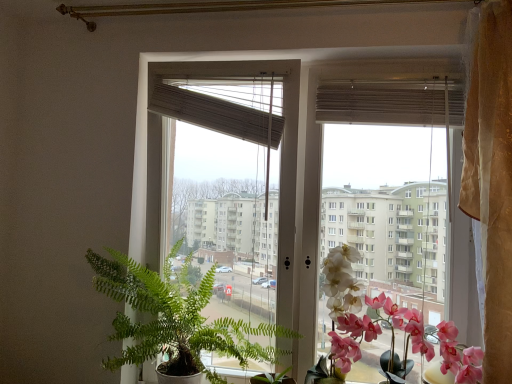
Consider the image. Measure the distance between point (492, 121) and camera.

The depth of point (492, 121) is 4.44 feet.

The height and width of the screenshot is (384, 512). What do you see at coordinates (381, 103) in the screenshot?
I see `matte brown blind at upper center, placed as the second blind when sorted from left to right` at bounding box center [381, 103].

At what (x,y) coordinates should I click in order to perform the action: click on matte brown blind at upper center, which appears as the first blind when viewed from the right. Please return your answer as a coordinate pair (x, y). This screenshot has width=512, height=384. Looking at the image, I should click on (381, 103).

The image size is (512, 384). Describe the element at coordinates (146, 137) in the screenshot. I see `transparent glass window at center` at that location.

The image size is (512, 384). What are the coordinates of `green leafy plant at left` in the screenshot? It's located at (175, 319).

Image resolution: width=512 pixels, height=384 pixels. Describe the element at coordinates (344, 307) in the screenshot. I see `white matte orchid at right, which is the 1th flower in left-to-right order` at that location.

Identify the location of beige textured curtain at right. (490, 174).

Which point is more distant from viewer, (360, 304) or (144, 209)?

The point (144, 209) is farther from the camera.

Is pink silk orchid at right, the 1th flower viewed from the right, not close to transparent glass window at center?

No.

Could you measure the distance between pink silk orchid at right, positioned as the 2th flower in left-to-right order, and transparent glass window at center?

pink silk orchid at right, positioned as the 2th flower in left-to-right order, and transparent glass window at center are 16.32 inches apart from each other.

Is pink silk orchid at right, the 1th flower viewed from the right, wider or thinner than transparent glass window at center?

In the image, pink silk orchid at right, the 1th flower viewed from the right, appears to be wider than transparent glass window at center.

Does white matte orchid at right, which is the 1th flower in left-to-right order, appear on the right side of transparent glass window at center?

Yes.

Between point (333, 262) and point (167, 222), which one is positioned behind?

Point (167, 222)

Is white matte orchid at right, which is the 1th flower in left-to-right order, positioned before transparent glass window at center?

Yes, the depth of white matte orchid at right, which is the 1th flower in left-to-right order, is less than that of transparent glass window at center.

Is white matte orchid at right, placed as the 2th flower when sorted from right to left, in contact with transparent glass window at center?

white matte orchid at right, placed as the 2th flower when sorted from right to left, and transparent glass window at center are not in contact.

From a real-world perspective, is pink silk orchid at right, positioned as the 2th flower in left-to-right order, below green leafy plant at left?

Yes, from a real-world perspective, pink silk orchid at right, positioned as the 2th flower in left-to-right order, is below green leafy plant at left.

Can you see pink silk orchid at right, positioned as the 2th flower in left-to-right order, touching green leafy plant at left?

They are not placed beside each other.

Who is smaller, pink silk orchid at right, the 1th flower viewed from the right, or green leafy plant at left?

With smaller size is pink silk orchid at right, the 1th flower viewed from the right.

Choose the correct answer: Is matte brown blind at upper center, placed as the second blind when sorted from left to right, inside pink silk orchid at right, the 1th flower viewed from the right, or outside it?

The correct answer is: outside.

Between point (379, 85) and point (366, 328), which one is positioned behind?

The point (379, 85) is more distant.

Visually, is matte brown blind at upper center, placed as the second blind when sorted from left to right, positioned to the left or to the right of pink silk orchid at right, the 1th flower viewed from the right?

In the image, matte brown blind at upper center, placed as the second blind when sorted from left to right, appears on the left side of pink silk orchid at right, the 1th flower viewed from the right.

Would you say white matte orchid at right, placed as the 2th flower when sorted from right to left, is outside pink silk orchid at right, the 1th flower viewed from the right?

No, white matte orchid at right, placed as the 2th flower when sorted from right to left, is not entirely external to pink silk orchid at right, the 1th flower viewed from the right.

From the image's perspective, which one is positioned higher, white matte orchid at right, placed as the 2th flower when sorted from right to left, or pink silk orchid at right, the 1th flower viewed from the right?

white matte orchid at right, placed as the 2th flower when sorted from right to left, appears higher in the image.

Measure the distance between white matte orchid at right, placed as the 2th flower when sorted from right to left, and pink silk orchid at right, positioned as the 2th flower in left-to-right order.

They are 2.14 inches apart.

Locate an element on the screen. The image size is (512, 384). flower located behind the white matte orchid at right, placed as the 2th flower when sorted from right to left is located at coordinates (366, 318).

Considering the relative sizes of beige woven blind at upper center, the 2th blind when ordered from right to left, and beige textured curtain at right in the image provided, is beige woven blind at upper center, the 2th blind when ordered from right to left, thinner than beige textured curtain at right?

Indeed, beige woven blind at upper center, the 2th blind when ordered from right to left, has a lesser width compared to beige textured curtain at right.

Is beige woven blind at upper center, the 2th blind when ordered from right to left, in front of or behind beige textured curtain at right in the image?

beige woven blind at upper center, the 2th blind when ordered from right to left, is positioned farther from the viewer than beige textured curtain at right.

Between beige woven blind at upper center, placed as the first blind when sorted from left to right, and beige textured curtain at right, which one has less height?

beige woven blind at upper center, placed as the first blind when sorted from left to right, is shorter.

Is point (191, 335) closer to camera compared to point (503, 372)?

No, (191, 335) is behind (503, 372).

Between green leafy plant at left and beige textured curtain at right, which one has less height?

green leafy plant at left is shorter.

Consider the image. Is beige textured curtain at right at the back of green leafy plant at left?

No, green leafy plant at left's orientation is not away from beige textured curtain at right.

Based on their positions, is green leafy plant at left located to the left or right of beige textured curtain at right?

Based on their positions, green leafy plant at left is located to the left of beige textured curtain at right.

At what (x,y) coordinates should I click in order to perform the action: click on the 1st flower in front of the transparent glass window at center, starting your count from the anchor. Please return your answer as a coordinate pair (x, y). Image resolution: width=512 pixels, height=384 pixels. Looking at the image, I should click on (366, 318).

Identify the location of window above the white matte orchid at right, which is the 1th flower in left-to-right order (from the image's perspective). (146, 137).

Considering their positions, is beige woven blind at upper center, the 2th blind when ordered from right to left, positioned further to green leafy plant at left than beige textured curtain at right?

Based on the image, beige textured curtain at right appears to be further to green leafy plant at left.

Based on the photo, based on their spatial positions, is transparent glass window at center or pink silk orchid at right, the 1th flower viewed from the right, closer to white matte orchid at right, which is the 1th flower in left-to-right order?

Based on the image, pink silk orchid at right, the 1th flower viewed from the right, appears to be nearer to white matte orchid at right, which is the 1th flower in left-to-right order.

Estimate the real-world distances between objects in this image. Which object is further from matte brown blind at upper center, placed as the second blind when sorted from left to right, beige woven blind at upper center, the 2th blind when ordered from right to left, or green leafy plant at left?

green leafy plant at left lies further to matte brown blind at upper center, placed as the second blind when sorted from left to right, than the other object.

Looking at the image, which one is located further to transparent glass window at center, white matte orchid at right, which is the 1th flower in left-to-right order, or matte brown blind at upper center, placed as the second blind when sorted from left to right?

matte brown blind at upper center, placed as the second blind when sorted from left to right, is positioned further to the anchor transparent glass window at center.

Which object lies further to the anchor point white matte orchid at right, placed as the 2th flower when sorted from right to left, transparent glass window at center or beige woven blind at upper center, placed as the first blind when sorted from left to right?

beige woven blind at upper center, placed as the first blind when sorted from left to right, is positioned further to the anchor white matte orchid at right, placed as the 2th flower when sorted from right to left.

Estimate the real-world distances between objects in this image. Which object is further from beige textured curtain at right, pink silk orchid at right, positioned as the 2th flower in left-to-right order, or beige woven blind at upper center, placed as the first blind when sorted from left to right?

beige woven blind at upper center, placed as the first blind when sorted from left to right.

Considering their positions, is beige woven blind at upper center, placed as the first blind when sorted from left to right, positioned further to matte brown blind at upper center, placed as the second blind when sorted from left to right, than white matte orchid at right, which is the 1th flower in left-to-right order?

Among the two, white matte orchid at right, which is the 1th flower in left-to-right order, is located further to matte brown blind at upper center, placed as the second blind when sorted from left to right.

Estimate the real-world distances between objects in this image. Which object is closer to beige textured curtain at right, matte brown blind at upper center, placed as the second blind when sorted from left to right, or green leafy plant at left?

The object closer to beige textured curtain at right is matte brown blind at upper center, placed as the second blind when sorted from left to right.

Locate an element on the screen. This screenshot has height=384, width=512. flower between green leafy plant at left and pink silk orchid at right, positioned as the 2th flower in left-to-right order, in the horizontal direction is located at coordinates (344, 307).

This screenshot has width=512, height=384. In order to click on blind between matte brown blind at upper center, placed as the second blind when sorted from left to right, and pink silk orchid at right, the 1th flower viewed from the right, in the vertical direction in this screenshot , I will do `click(210, 112)`.

Locate an element on the screen. The image size is (512, 384). blind situated between transparent glass window at center and beige textured curtain at right from left to right is located at coordinates (381, 103).

Find the location of a particular element. The width and height of the screenshot is (512, 384). flower between beige woven blind at upper center, the 2th blind when ordered from right to left, and pink silk orchid at right, the 1th flower viewed from the right, in the up-down direction is located at coordinates (344, 307).